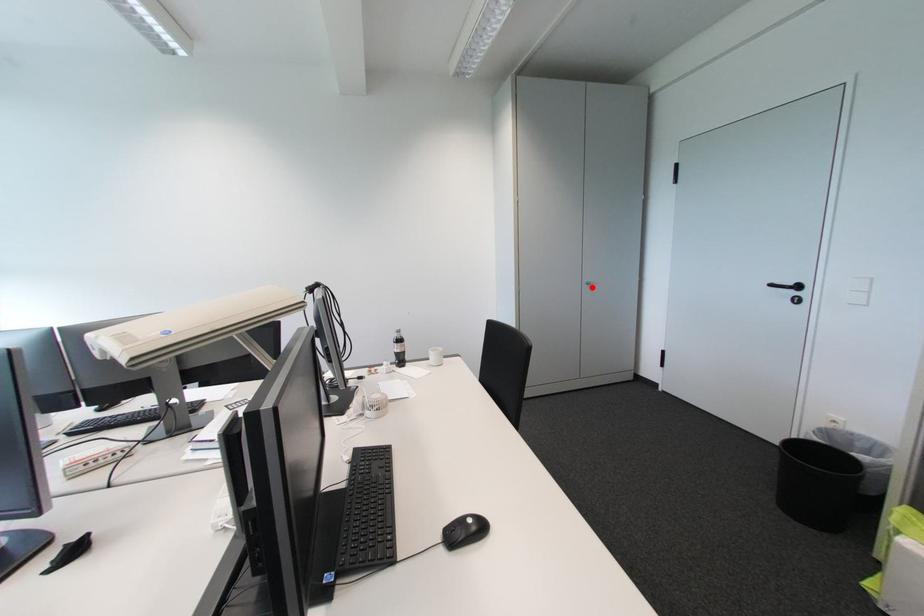
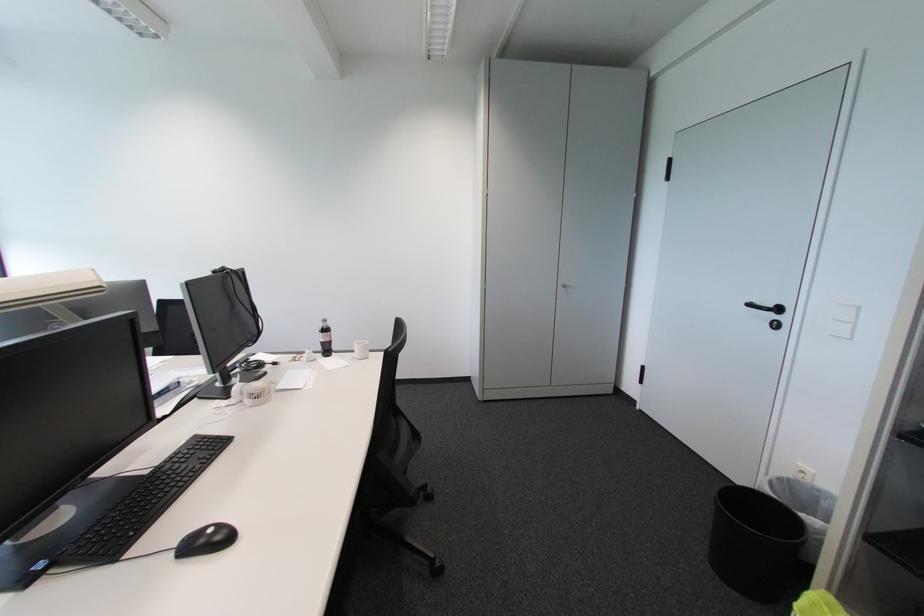
Locate, in the second image, the point that corresponds to the highlighted location in the first image.

(567, 290)